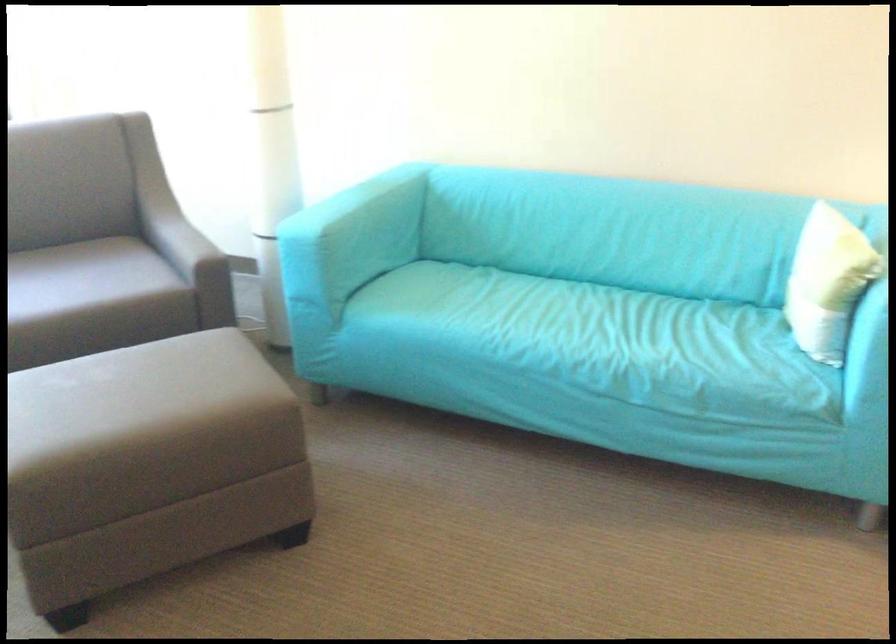
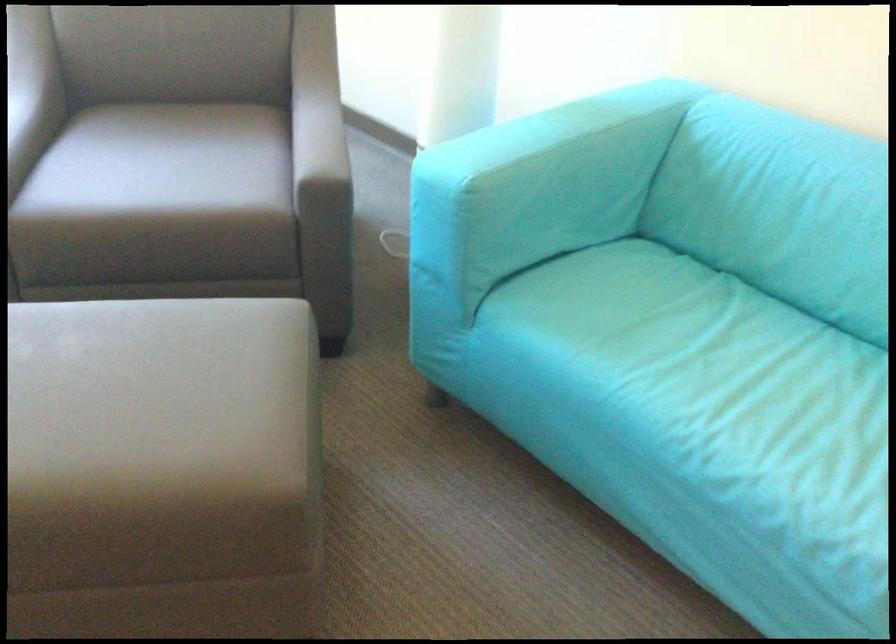
Question: The camera is either moving clockwise (left) or counter-clockwise (right) around the object. The first image is from the beginning of the video and the second image is from the end. Is the camera moving left or right when shooting the video?

Choices:
 (A) Left
 (B) Right

Answer: (B)